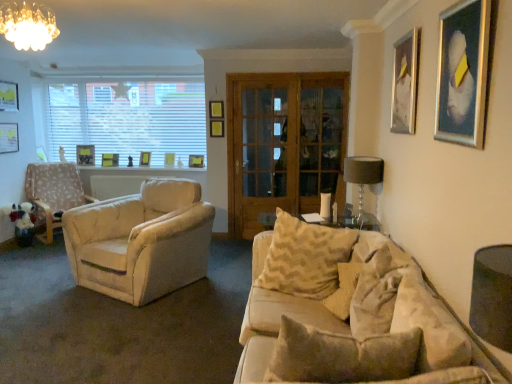
Locate an element on the screen. empty space that is ontop of wooden glass door at center (from a real-world perspective) is located at coordinates (292, 69).